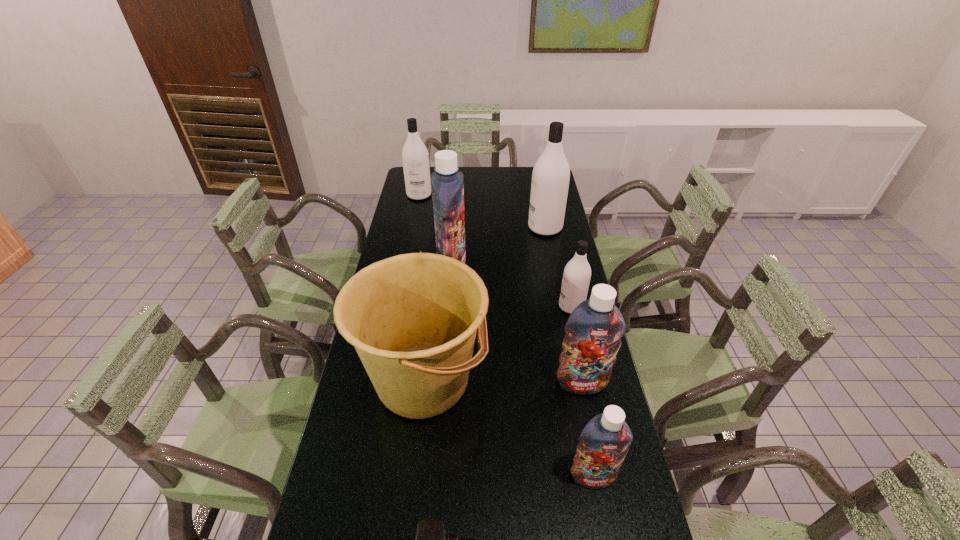
This screenshot has height=540, width=960. What are the coordinates of `vacant space situated 0.240m on the front-facing side of the smallest white shampoo` in the screenshot? It's located at (489, 307).

Identify the location of vacant region located 0.130m on the front-facing side of the smallest white shampoo. (520, 307).

The height and width of the screenshot is (540, 960). I want to click on free space located 0.130m on the front-facing side of the smallest white shampoo, so click(520, 307).

Locate an element on the screen. object that is at the far edge is located at coordinates (415, 158).

You are a GUI agent. You are given a task and a screenshot of the screen. Output one action in this format:
    pyautogui.click(x=<x>, y=<y>)
    Task: Click on the shampoo present at the left edge
    The image size is (960, 540).
    Given the screenshot: What is the action you would take?
    pyautogui.click(x=415, y=158)

You are a GUI agent. You are given a task and a screenshot of the screen. Output one action in this format:
    pyautogui.click(x=<x>, y=<y>)
    Task: Click on the bucket at the left edge
    
    Given the screenshot: What is the action you would take?
    pyautogui.click(x=412, y=318)

Where is `object located in the far left corner section of the desktop`? This screenshot has height=540, width=960. object located in the far left corner section of the desktop is located at coordinates (415, 158).

The width and height of the screenshot is (960, 540). Identify the location of vacant space at the far edge of the desktop. (519, 183).

This screenshot has width=960, height=540. Find the location of `blank space at the left edge of the desktop`. blank space at the left edge of the desktop is located at coordinates (395, 469).

The height and width of the screenshot is (540, 960). What are the coordinates of `unoccupied position between the fifth nearest shampoo and the farthest blue shampoo` in the screenshot? It's located at (498, 246).